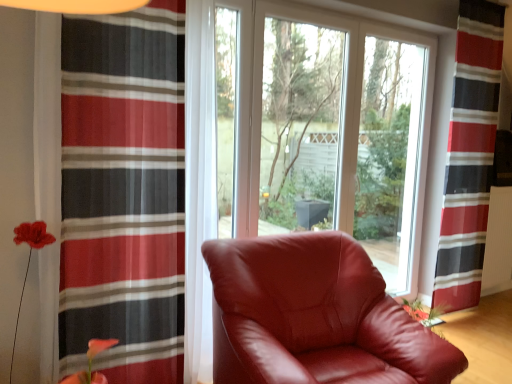
What do you see at coordinates (469, 156) in the screenshot?
I see `red striped curtain at right, the 1th curtain viewed from the right` at bounding box center [469, 156].

I want to click on transparent glass window at center, so coord(300,125).

Identify the location of satin burgundy armchair at center. This screenshot has width=512, height=384. (315, 316).

Does red striped curtain at right, positioned as the second curtain in left-to-right order, have a lesser height compared to satin burgundy armchair at center?

Incorrect, the height of red striped curtain at right, positioned as the second curtain in left-to-right order, does not fall short of that of satin burgundy armchair at center.

Visually, is red striped curtain at right, the 2th curtain when ordered from front to back, positioned to the left or to the right of satin burgundy armchair at center?

red striped curtain at right, the 2th curtain when ordered from front to back, is positioned on satin burgundy armchair at center's right side.

Would you say red striped curtain at right, placed as the 1th curtain when sorted from back to front, is outside satin burgundy armchair at center?

Yes, red striped curtain at right, placed as the 1th curtain when sorted from back to front, is not within satin burgundy armchair at center.

What's the angular difference between red striped curtain at right, the 2th curtain when ordered from front to back, and striped sheer curtain at left, the 2th curtain in the back-to-front sequence,'s facing directions?

0.913 degrees separate the facing orientations of red striped curtain at right, the 2th curtain when ordered from front to back, and striped sheer curtain at left, the 2th curtain in the back-to-front sequence.

Does red striped curtain at right, the 1th curtain viewed from the right, appear on the left side of striped sheer curtain at left, acting as the second curtain starting from the right?

No.

This screenshot has height=384, width=512. I want to click on curtain that is above the striped sheer curtain at left, the 2th curtain in the back-to-front sequence (from the image's perspective), so click(469, 156).

From a real-world perspective, which curtain is the 2nd one underneath the transparent glass window at center? Please provide its 2D coordinates.

[(124, 192)]

Is transparent glass window at center thinner than striped sheer curtain at left, the 2th curtain in the back-to-front sequence?

Correct, the width of transparent glass window at center is less than that of striped sheer curtain at left, the 2th curtain in the back-to-front sequence.

Considering the relative sizes of transparent glass window at center and striped sheer curtain at left, placed as the 1th curtain when sorted from left to right, in the image provided, is transparent glass window at center shorter than striped sheer curtain at left, placed as the 1th curtain when sorted from left to right,?

Yes, transparent glass window at center is shorter than striped sheer curtain at left, placed as the 1th curtain when sorted from left to right.

Considering the relative sizes of striped sheer curtain at left, the 2th curtain in the back-to-front sequence, and red striped curtain at right, the 1th curtain viewed from the right, in the image provided, is striped sheer curtain at left, the 2th curtain in the back-to-front sequence, thinner than red striped curtain at right, the 1th curtain viewed from the right,?

No, striped sheer curtain at left, the 2th curtain in the back-to-front sequence, is not thinner than red striped curtain at right, the 1th curtain viewed from the right.

Is striped sheer curtain at left, the 2th curtain in the back-to-front sequence, positioned before red striped curtain at right, positioned as the second curtain in left-to-right order?

Yes, striped sheer curtain at left, the 2th curtain in the back-to-front sequence, is closer to the viewer.

Is striped sheer curtain at left, the 2th curtain in the back-to-front sequence, far from red striped curtain at right, placed as the 1th curtain when sorted from back to front?

Yes, striped sheer curtain at left, the 2th curtain in the back-to-front sequence, and red striped curtain at right, placed as the 1th curtain when sorted from back to front, are quite far apart.

Considering the sizes of objects striped sheer curtain at left, placed as the 1th curtain when sorted from left to right, and red striped curtain at right, the 2th curtain when ordered from front to back, in the image provided, who is smaller, striped sheer curtain at left, placed as the 1th curtain when sorted from left to right, or red striped curtain at right, the 2th curtain when ordered from front to back,?

red striped curtain at right, the 2th curtain when ordered from front to back.

Which of these two, red striped curtain at right, the 1th curtain viewed from the right, or transparent glass window at center, is smaller?

transparent glass window at center is smaller.

In the scene shown: Between red striped curtain at right, placed as the 1th curtain when sorted from back to front, and transparent glass window at center, which one appears on the left side from the viewer's perspective?

From the viewer's perspective, transparent glass window at center appears more on the left side.

In the scene shown: Measure the distance between red striped curtain at right, the 2th curtain when ordered from front to back, and transparent glass window at center.

A distance of 3.75 feet exists between red striped curtain at right, the 2th curtain when ordered from front to back, and transparent glass window at center.

Image resolution: width=512 pixels, height=384 pixels. What are the coordinates of `window screen above the red striped curtain at right, placed as the 1th curtain when sorted from back to front (from the image's perspective)` in the screenshot? It's located at (300, 125).

Does satin burgundy armchair at center touch striped sheer curtain at left, acting as the second curtain starting from the right?

No.

Locate an element on the screen. Image resolution: width=512 pixels, height=384 pixels. chair that is under the striped sheer curtain at left, acting as the second curtain starting from the right (from a real-world perspective) is located at coordinates (315, 316).

From a real-world perspective, which object stands above the other?

transparent glass window at center, from a real-world perspective.

From their relative heights in the image, would you say transparent glass window at center is taller or shorter than satin burgundy armchair at center?

Clearly, transparent glass window at center is taller compared to satin burgundy armchair at center.

From the image's perspective, between transparent glass window at center and satin burgundy armchair at center, who is located below?

satin burgundy armchair at center appears lower in the image.

Where is `chair that appears below the red striped curtain at right, the 2th curtain when ordered from front to back (from the image's perspective)`? The width and height of the screenshot is (512, 384). chair that appears below the red striped curtain at right, the 2th curtain when ordered from front to back (from the image's perspective) is located at coordinates (315, 316).

At what (x,y) coordinates should I click in order to perform the action: click on curtain behind the striped sheer curtain at left, which ranks as the first curtain in front-to-back order. Please return your answer as a coordinate pair (x, y). Looking at the image, I should click on (469, 156).

Based on their spatial positions, is satin burgundy armchair at center or transparent glass window at center further from striped sheer curtain at left, the 2th curtain in the back-to-front sequence?

Among the two, transparent glass window at center is located further to striped sheer curtain at left, the 2th curtain in the back-to-front sequence.

Based on their spatial positions, is satin burgundy armchair at center or red striped curtain at right, the 1th curtain viewed from the right, further from white textured radiator at right?

Among the two, satin burgundy armchair at center is located further to white textured radiator at right.

Estimate the real-world distances between objects in this image. Which object is further from transparent glass window at center, red striped curtain at right, the 2th curtain when ordered from front to back, or white textured radiator at right?

The object further to transparent glass window at center is white textured radiator at right.

From the picture: Based on their spatial positions, is satin burgundy armchair at center or striped sheer curtain at left, placed as the 1th curtain when sorted from left to right, closer to red striped curtain at right, placed as the 1th curtain when sorted from back to front?

satin burgundy armchair at center is positioned closer to the anchor red striped curtain at right, placed as the 1th curtain when sorted from back to front.

Based on their spatial positions, is red striped curtain at right, the 1th curtain viewed from the right, or white textured radiator at right further from satin burgundy armchair at center?

white textured radiator at right.

Considering their positions, is transparent glass window at center positioned closer to striped sheer curtain at left, the 2th curtain in the back-to-front sequence, than red striped curtain at right, placed as the 1th curtain when sorted from back to front?

transparent glass window at center is positioned closer to the anchor striped sheer curtain at left, the 2th curtain in the back-to-front sequence.

Which object lies nearer to the anchor point red striped curtain at right, placed as the 1th curtain when sorted from back to front, white textured radiator at right or satin burgundy armchair at center?

white textured radiator at right lies closer to red striped curtain at right, placed as the 1th curtain when sorted from back to front, than the other object.

Looking at the image, which one is located closer to striped sheer curtain at left, the 2th curtain in the back-to-front sequence, transparent glass window at center or white textured radiator at right?

Based on the image, transparent glass window at center appears to be nearer to striped sheer curtain at left, the 2th curtain in the back-to-front sequence.

Locate an element on the screen. The image size is (512, 384). window screen located between striped sheer curtain at left, placed as the 1th curtain when sorted from left to right, and red striped curtain at right, the 2th curtain when ordered from front to back, in the left-right direction is located at coordinates (300, 125).

The height and width of the screenshot is (384, 512). I want to click on curtain situated between transparent glass window at center and white textured radiator at right from left to right, so click(x=469, y=156).

Locate an element on the screen. This screenshot has width=512, height=384. window screen between satin burgundy armchair at center and white textured radiator at right along the z-axis is located at coordinates (300, 125).

Locate an element on the screen. window screen between striped sheer curtain at left, the 2th curtain in the back-to-front sequence, and white textured radiator at right, in the horizontal direction is located at coordinates (300, 125).